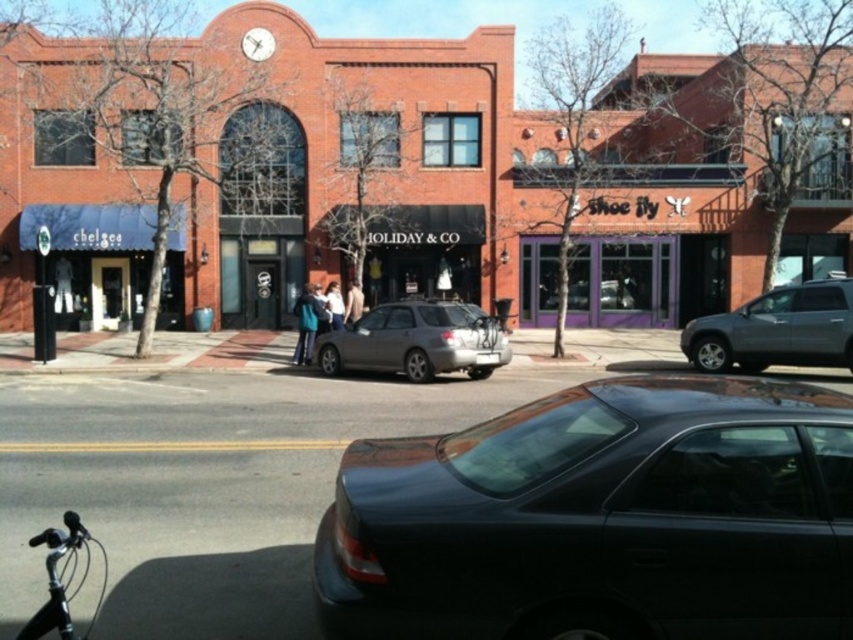
Which of these two, shiny black sedan at center or satin silver sedan at center, stands shorter?

Standing shorter between the two is shiny black sedan at center.

At what (x,y) coordinates should I click in order to perform the action: click on shiny black sedan at center. Please return your answer as a coordinate pair (x, y). Looking at the image, I should click on click(601, 518).

Is point (550, 412) behind point (332, 356)?

No, (550, 412) is closer to viewer.

Where is `shiny black sedan at center`? This screenshot has width=853, height=640. shiny black sedan at center is located at coordinates (601, 518).

Is point (772, 438) farther from camera compared to point (51, 628)?

Yes, point (772, 438) is farther from viewer.

Between point (399, 474) and point (102, 547), which one is positioned in front?

Point (399, 474) is more forward.

Find the location of a particular element. This screenshot has height=640, width=853. shiny black sedan at center is located at coordinates (601, 518).

Can you confirm if satin silver sedan at center is positioned below shiny silver handlebars at lower left?

No.

Does satin silver sedan at center appear over shiny silver handlebars at lower left?

Yes.

What are the coordinates of `satin silver sedan at center` in the screenshot? It's located at (416, 340).

You are a GUI agent. You are given a task and a screenshot of the screen. Output one action in this format:
    pyautogui.click(x=<x>, y=<y>)
    Task: Click on the satin silver sedan at center
    The width and height of the screenshot is (853, 640).
    Given the screenshot: What is the action you would take?
    pyautogui.click(x=416, y=340)